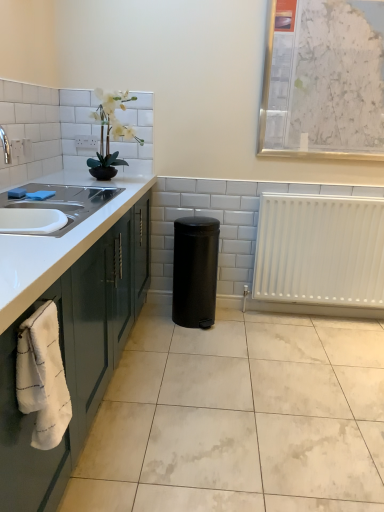
Where is `free space in front of black matte trash can at center`? This screenshot has height=512, width=384. free space in front of black matte trash can at center is located at coordinates (198, 342).